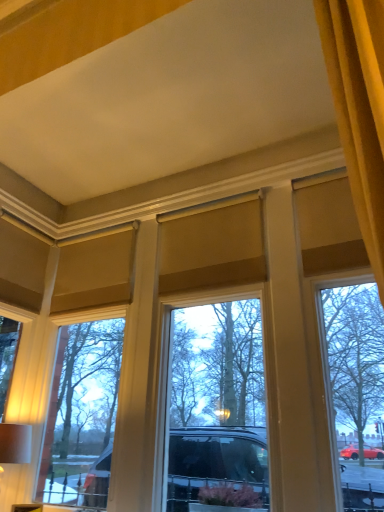
The width and height of the screenshot is (384, 512). Describe the element at coordinates (190, 304) in the screenshot. I see `matte glass window at center` at that location.

Locate an element on the screen. matte glass window at center is located at coordinates (190, 304).

The width and height of the screenshot is (384, 512). What do you see at coordinates (15, 443) in the screenshot?
I see `matte white table lamp at lower left` at bounding box center [15, 443].

This screenshot has width=384, height=512. I want to click on matte white table lamp at lower left, so click(15, 443).

From the picture: Measure the distance between matte white table lamp at lower left and camera.

The distance of matte white table lamp at lower left from camera is 2.23 meters.

This screenshot has height=512, width=384. I want to click on matte glass window at center, so click(190, 304).

Is matte white table lamp at lower left to the left or to the right of matte glass window at center in the image?

In the image, matte white table lamp at lower left appears on the left side of matte glass window at center.

Is the depth of matte white table lamp at lower left less than that of matte glass window at center?

No, the depth of matte white table lamp at lower left is greater than that of matte glass window at center.

Does point (16, 452) come in front of point (127, 408)?

Yes, point (16, 452) is closer to viewer.

From the image's perspective, who appears lower, matte white table lamp at lower left or matte glass window at center?

matte white table lamp at lower left, from the image's perspective.

From a real-world perspective, between matte white table lamp at lower left and matte glass window at center, who is vertically lower?

matte white table lamp at lower left is physically lower.

Considering the sizes of objects matte white table lamp at lower left and matte glass window at center in the image provided, who is thinner, matte white table lamp at lower left or matte glass window at center?

Thinner between the two is matte glass window at center.

Who is shorter, matte white table lamp at lower left or matte glass window at center?

Standing shorter between the two is matte white table lamp at lower left.

Considering the relative sizes of matte white table lamp at lower left and matte glass window at center in the image provided, is matte white table lamp at lower left bigger than matte glass window at center?

Incorrect, matte white table lamp at lower left is not larger than matte glass window at center.

Is matte glass window at center a part of matte white table lamp at lower left?

No, matte glass window at center is not surrounded by matte white table lamp at lower left.

Is matte white table lamp at lower left not near matte glass window at center?

matte white table lamp at lower left is near matte glass window at center, not far away.

Does matte white table lamp at lower left turn towards matte glass window at center?

No, matte white table lamp at lower left is not turned towards matte glass window at center.

Can you tell me how much matte white table lamp at lower left and matte glass window at center differ in facing direction?

The angle between the facing direction of matte white table lamp at lower left and the facing direction of matte glass window at center is 0.161 degrees.

Where is `table lamp directly beneath the matte glass window at center (from a real-world perspective)`? The height and width of the screenshot is (512, 384). table lamp directly beneath the matte glass window at center (from a real-world perspective) is located at coordinates 15,443.

Does matte glass window at center appear on the left side of matte white table lamp at lower left?

Incorrect, matte glass window at center is not on the left side of matte white table lamp at lower left.

Which object is further away from the camera taking this photo, matte glass window at center or matte white table lamp at lower left?

matte white table lamp at lower left is behind.

Does point (34, 477) come behind point (29, 433)?

Yes, it is.

From the image's perspective, who appears lower, matte glass window at center or matte white table lamp at lower left?

matte white table lamp at lower left.

From a real-world perspective, which object rests below the other?

From a 3D spatial view, matte white table lamp at lower left is below.

Considering the relative sizes of matte glass window at center and matte white table lamp at lower left in the image provided, is matte glass window at center wider than matte white table lamp at lower left?

No.

In terms of height, does matte glass window at center look taller or shorter compared to matte white table lamp at lower left?

Considering their sizes, matte glass window at center has more height than matte white table lamp at lower left.

Considering the relative sizes of matte glass window at center and matte white table lamp at lower left in the image provided, is matte glass window at center smaller than matte white table lamp at lower left?

Actually, matte glass window at center might be larger than matte white table lamp at lower left.

Is matte white table lamp at lower left completely or partially inside matte glass window at center?

Actually, matte white table lamp at lower left is outside matte glass window at center.

Is matte glass window at center next to matte white table lamp at lower left and touching it?

No, matte glass window at center is not with matte white table lamp at lower left.

Is matte glass window at center looking in the opposite direction of matte white table lamp at lower left?

Yes, matte glass window at center is facing away from matte white table lamp at lower left.

How different are the orientations of matte glass window at center and matte white table lamp at lower left in degrees?

The facing directions of matte glass window at center and matte white table lamp at lower left are 0.161 degrees apart.

I want to click on window in front of the matte white table lamp at lower left, so click(190, 304).

You are a GUI agent. You are given a task and a screenshot of the screen. Output one action in this format:
    pyautogui.click(x=<x>, y=<y>)
    Task: Click on the window that is above the matte white table lamp at lower left (from the image's perspective)
    The image size is (384, 512).
    Given the screenshot: What is the action you would take?
    pyautogui.click(x=190, y=304)

I want to click on table lamp below the matte glass window at center (from a real-world perspective), so click(x=15, y=443).